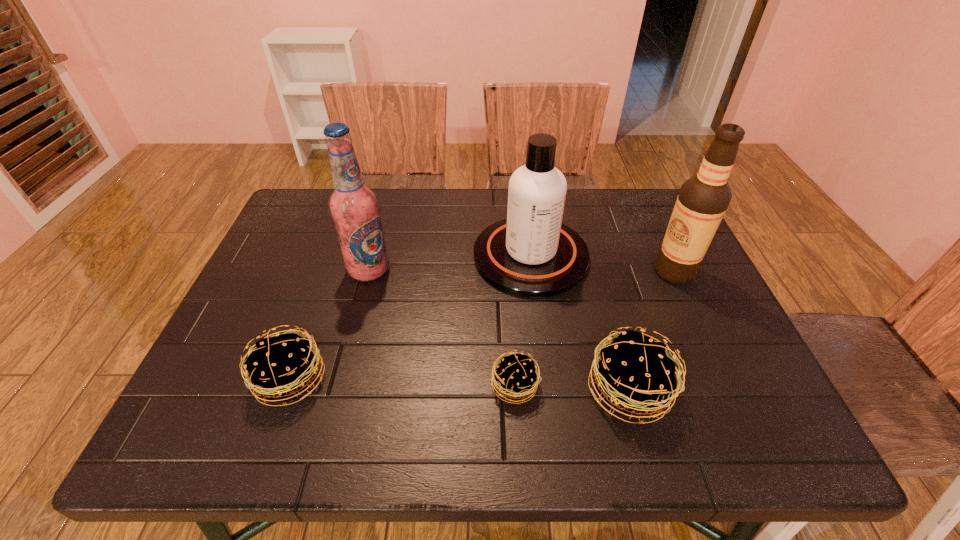
Identify the location of free point located on the back of the rightmost patty. The image size is (960, 540). (592, 257).

This screenshot has width=960, height=540. In order to click on vacant area situated 0.160m on the right of the cleansing agent in this screenshot , I will do `click(647, 256)`.

Locate an element on the screen. The height and width of the screenshot is (540, 960). free space located on the front of the left alcohol is located at coordinates (350, 340).

Find the location of a particular element. Image resolution: width=960 pixels, height=540 pixels. free space located on the label of the right alcohol is located at coordinates (537, 271).

Identify the location of vacant region located 0.110m on the label of the right alcohol. (611, 271).

I want to click on free space located 0.170m on the label of the right alcohol, so pos(588,271).

Find the location of `object positioned at the far edge`. object positioned at the far edge is located at coordinates (532, 254).

Where is `object present at the left edge`? object present at the left edge is located at coordinates (281, 368).

Identify the location of object situated at the right edge. This screenshot has width=960, height=540. [x=703, y=199].

At what (x,y) coordinates should I click in order to perform the action: click on object present at the near left corner. Please return your answer as a coordinate pair (x, y). Image resolution: width=960 pixels, height=540 pixels. Looking at the image, I should click on 281,368.